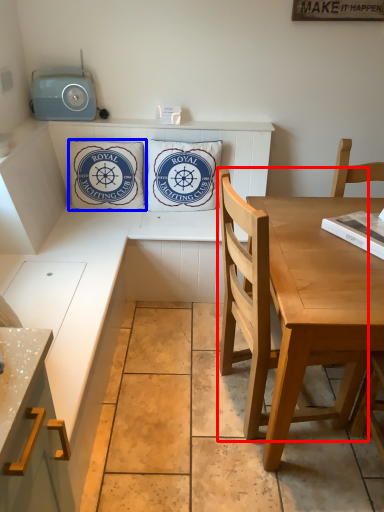
Question: Which object is further to the camera taking this photo, chair (highlighted by a red box) or pillow (highlighted by a blue box)?

Choices:
 (A) chair
 (B) pillow

Answer: (B)